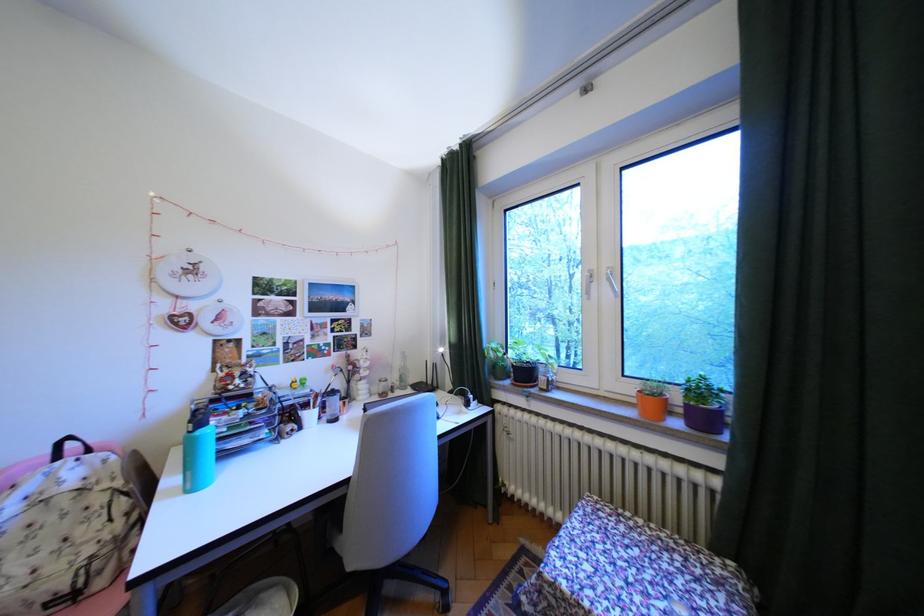
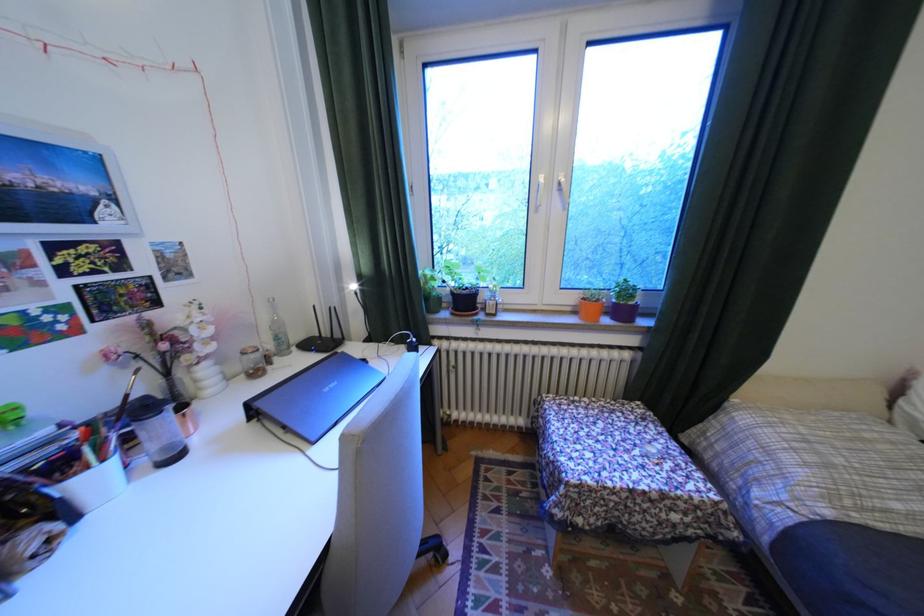
Locate, in the second image, the point that corresponds to pixel 322 415 in the first image.

(106, 479)